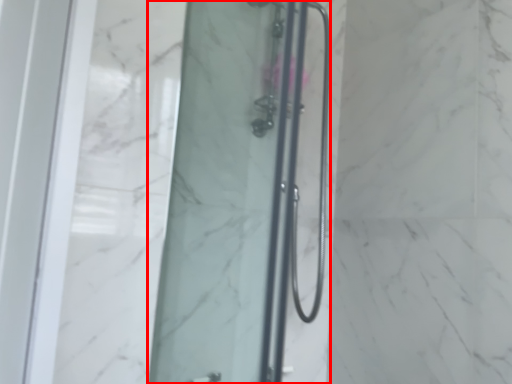
Question: From the image's perspective, where is shower door (annotated by the red box) located in relation to shower door in the image?

Choices:
 (A) above
 (B) below

Answer: (B)